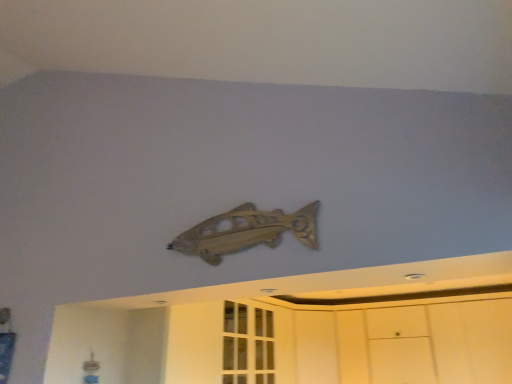
At what (x,y) coordinates should I click in order to perform the action: click on wooden fish at center. Please return your answer as a coordinate pair (x, y). Looking at the image, I should click on (246, 231).

Looking at this image, what is the approximate width of wooden fish at center?

wooden fish at center is 1.88 inches wide.

Describe the element at coordinates (246, 231) in the screenshot. I see `wooden fish at center` at that location.

Where is `wooden fish at center`? Image resolution: width=512 pixels, height=384 pixels. wooden fish at center is located at coordinates (246, 231).